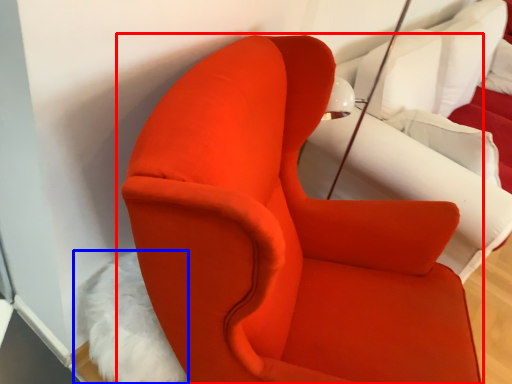
Question: Which point is closer to the camera, chair (highlighted by a red box) or animal (highlighted by a blue box)?

Choices:
 (A) chair
 (B) animal

Answer: (A)